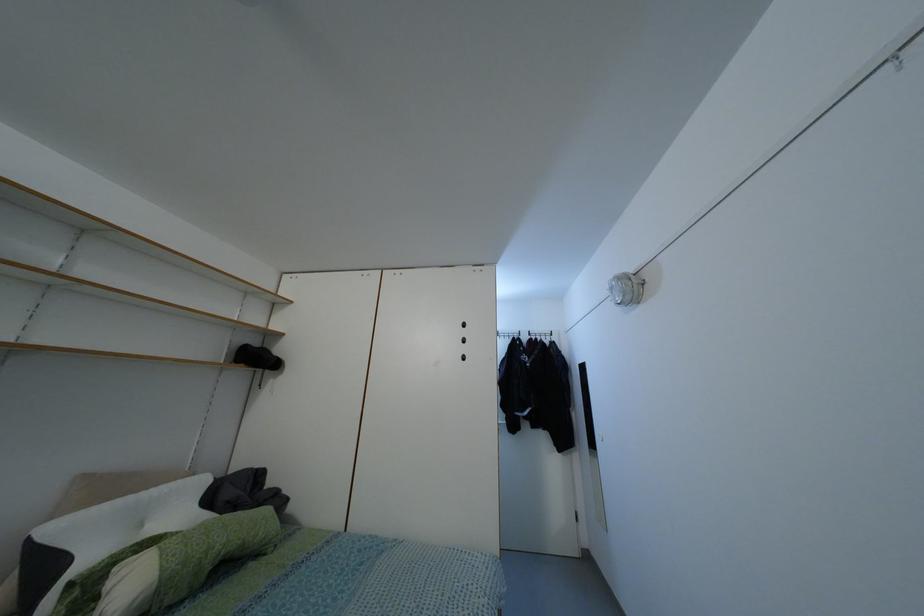
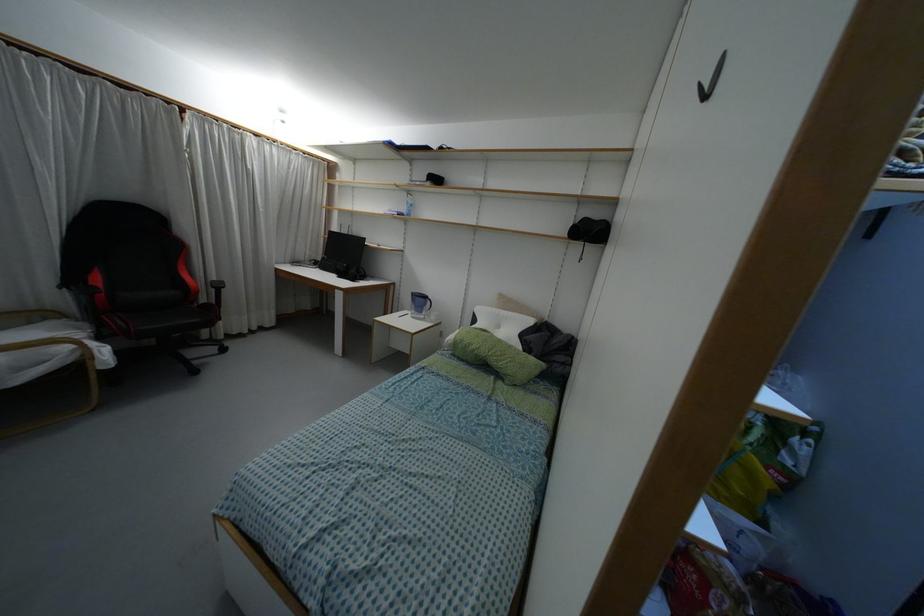
Find the pixel in the second image that matches (x=162, y=570) in the first image.

(455, 337)